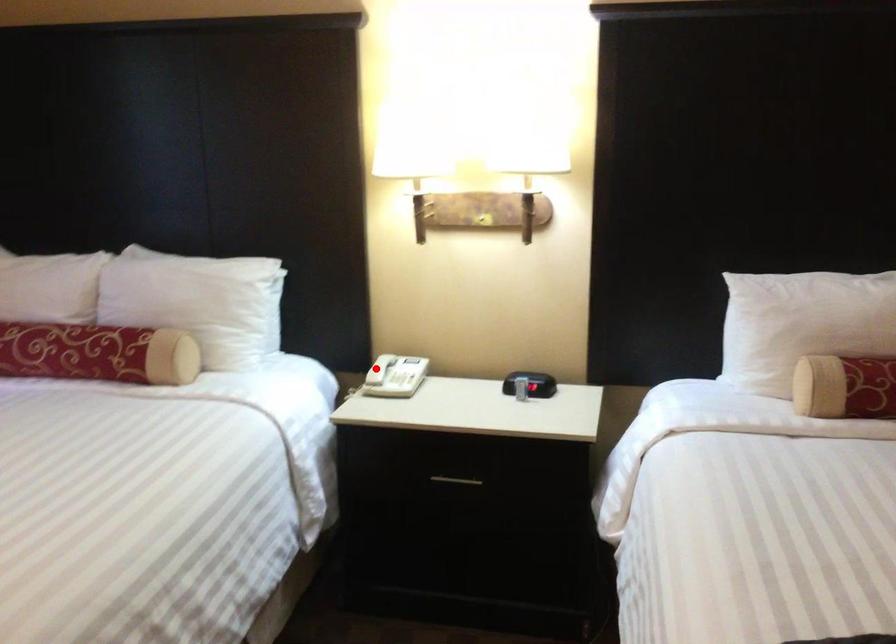
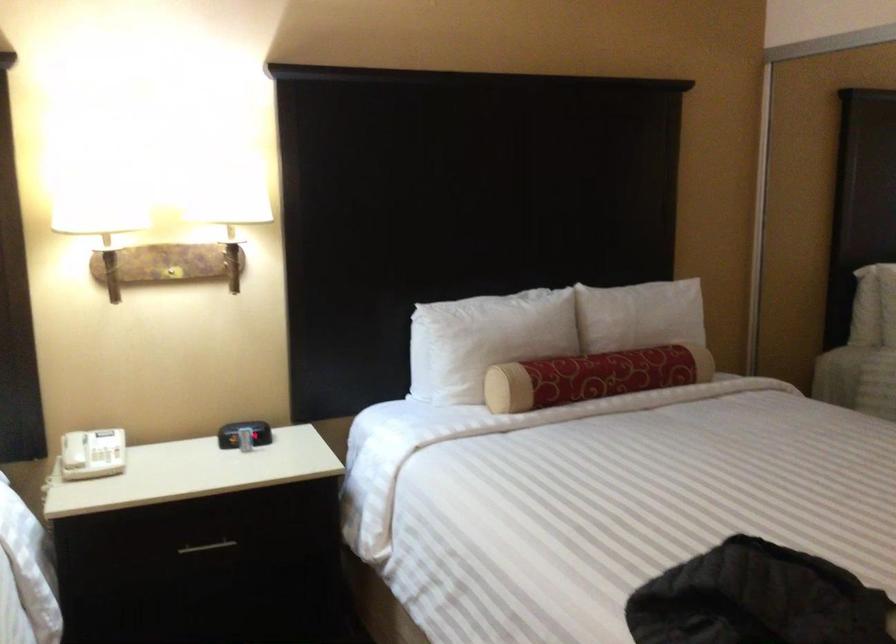
Locate, in the second image, the point that corresponds to the highlighted location in the first image.

(73, 450)